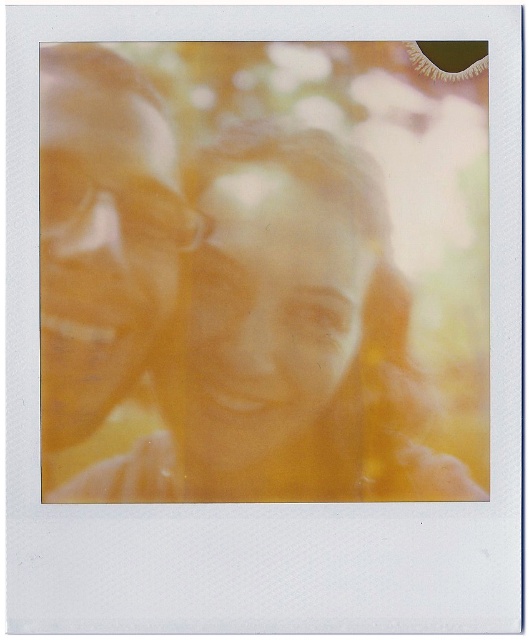
Does point (397, 369) come farther from viewer compared to point (258, 404)?

Yes, point (397, 369) is behind point (258, 404).

Between matte yellow hair at center and smooth skin face at center, which one is positioned higher?

Positioned higher is smooth skin face at center.

Where is `matte yellow hair at center`? matte yellow hair at center is located at coordinates (252, 332).

Who is shorter, matte yellow hair at center or matte orange face at center?

matte orange face at center

What do you see at coordinates (252, 332) in the screenshot?
I see `matte yellow hair at center` at bounding box center [252, 332].

Between point (59, 404) and point (130, 380), which one is positioned in front?

Point (59, 404)

You are a GUI agent. You are given a task and a screenshot of the screen. Output one action in this format:
    pyautogui.click(x=<x>, y=<y>)
    Task: Click on the matte yellow hair at center
    The height and width of the screenshot is (640, 529).
    Given the screenshot: What is the action you would take?
    pyautogui.click(x=252, y=332)

Describe the element at coordinates (267, 312) in the screenshot. This screenshot has width=529, height=640. I see `smooth skin face at center` at that location.

Is smooth skin face at center above matte orange face at center?

Incorrect, smooth skin face at center is not positioned above matte orange face at center.

Does point (312, 312) come closer to viewer compared to point (85, 412)?

No, it is not.

Find the location of a particular element. smooth skin face at center is located at coordinates (267, 312).